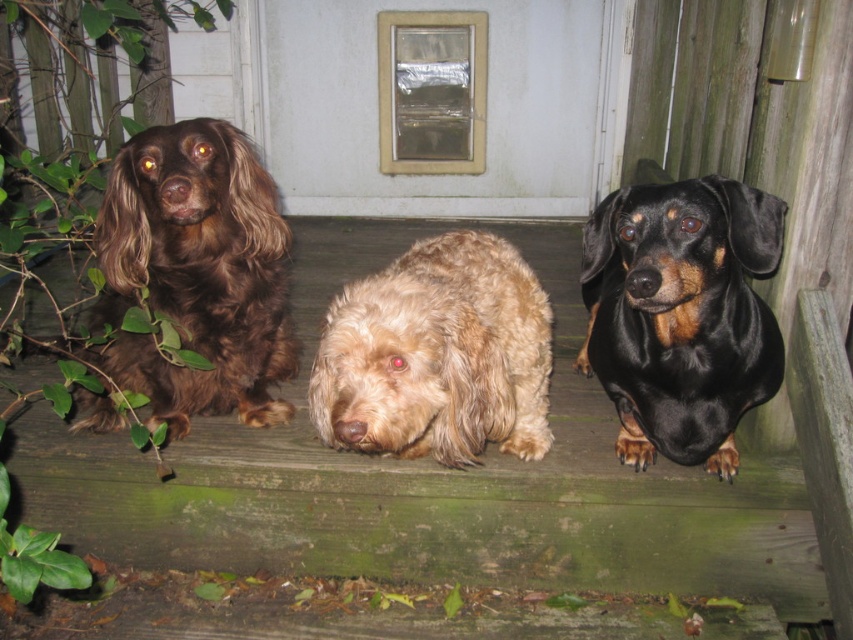
You are a dog trainer assessing the spacing between the shiny brown fur at left and the fuzzy beige dog at center on the weathered deck. Based on the image, is there enough space between them to comfortably fit a small dog toy measuring 30 centimeters in length?

The shiny brown fur at left and fuzzy beige dog at center are 44.51 centimeters apart. Since the small dog toy is 30 centimeters long, there is sufficient space between them to comfortably fit the toy.

You are standing on the wooden deck and want to locate the shiny brown fur at left. Based on the coordinates provided, where would you look relative to the deck?

The shiny brown fur at left is located at coordinates point [196,273], which means it is positioned approximately 42.8 percent from the left edge and 23.1 percent from the bottom edge of the deck.